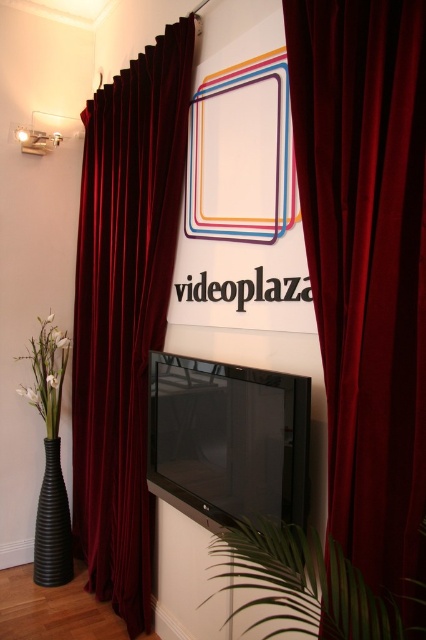
Question: Is velvet dark red curtain at left in front of white matte vase at lower left?

Choices:
 (A) no
 (B) yes

Answer: (B)

Question: Which point is closer to the camera?

Choices:
 (A) (175, 508)
 (B) (394, 600)
 (C) (411, 97)
 (D) (48, 432)

Answer: (C)

Question: From the image, what is the correct spatial relationship of velvet dark red curtain at left in relation to black ribbed vase at lower left?

Choices:
 (A) right
 (B) left

Answer: (A)

Question: Is green leafy plant at lower center bigger than white matte vase at lower left?

Choices:
 (A) yes
 (B) no

Answer: (A)

Question: Which object is positioned farthest from the black glossy flat screen tv at center?

Choices:
 (A) velvet dark red curtain at left
 (B) white matte vase at lower left
 (C) green leafy plant at lower center
 (D) velvet dark red curtain at center

Answer: (B)

Question: Estimate the real-world distances between objects in this image. Which object is closer to the velvet dark red curtain at center?

Choices:
 (A) velvet dark red curtain at left
 (B) green leafy plant at lower center

Answer: (B)